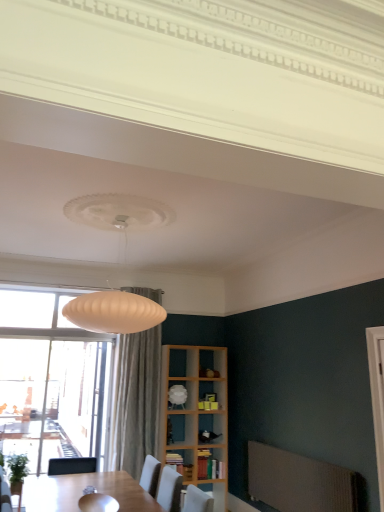
Question: Relative to white glossy shelf at center, the 2th shelf in the bottom-to-top sequence, is wooden bookshelf at lower center, the 2th shelf in the top-to-bottom sequence, in front or behind?

Choices:
 (A) front
 (B) behind

Answer: (A)

Question: Do you think wooden bookshelf at lower center, the 2th shelf in the top-to-bottom sequence, is within white glossy shelf at center, the first shelf when ordered from top to bottom, or outside of it?

Choices:
 (A) outside
 (B) inside

Answer: (A)

Question: Which object is the closest to the white glossy shelf at center, the first shelf when ordered from top to bottom?

Choices:
 (A) wooden bookshelf at lower center, positioned as the first shelf in bottom-to-top order
 (B) wooden bookshelf at center
 (C) white glossy screen door at right

Answer: (A)

Question: Which is nearer to the wooden bookshelf at center?

Choices:
 (A) white glossy shelf at center, the first shelf when ordered from top to bottom
 (B) wooden bookshelf at lower center, the 2th shelf in the top-to-bottom sequence
 (C) white glossy screen door at right

Answer: (B)